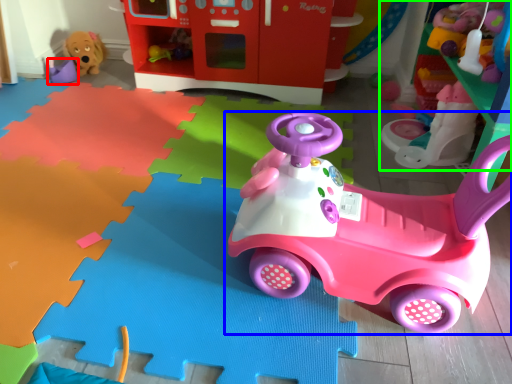
Question: Considering the real-world distances, which object is closest to toy (highlighted by a red box)? toy (highlighted by a blue box) or toy (highlighted by a green box).

Choices:
 (A) toy
 (B) toy

Answer: (B)